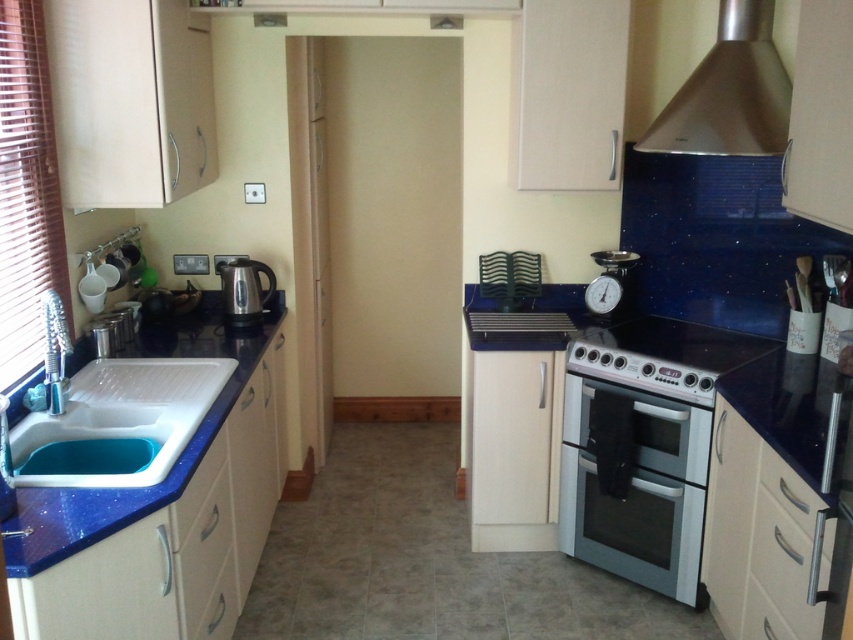
Is satin silver stove at center below metallic silver scale at right?

Correct, satin silver stove at center is located below metallic silver scale at right.

Can you confirm if satin silver stove at center is positioned to the left of metallic silver scale at right?

Incorrect, satin silver stove at center is not on the left side of metallic silver scale at right.

Between point (630, 336) and point (612, 289), which one is positioned behind?

Point (612, 289)

Where is `satin silver stove at center`? This screenshot has width=853, height=640. satin silver stove at center is located at coordinates (662, 355).

Which is in front, point (618, 566) or point (722, 38)?

Positioned in front is point (722, 38).

Between point (643, 486) and point (646, 131), which one is positioned in front?

Point (643, 486) is more forward.

Identify the location of white glossy oven at center. (633, 484).

Which is below, white glossy oven at center or polished stainless steel kettle at left?

Positioned lower is white glossy oven at center.

Does white glossy oven at center have a lesser width compared to polished stainless steel kettle at left?

No, white glossy oven at center is not thinner than polished stainless steel kettle at left.

What do you see at coordinates (633, 484) in the screenshot?
I see `white glossy oven at center` at bounding box center [633, 484].

Locate an element on the screen. white glossy oven at center is located at coordinates (633, 484).